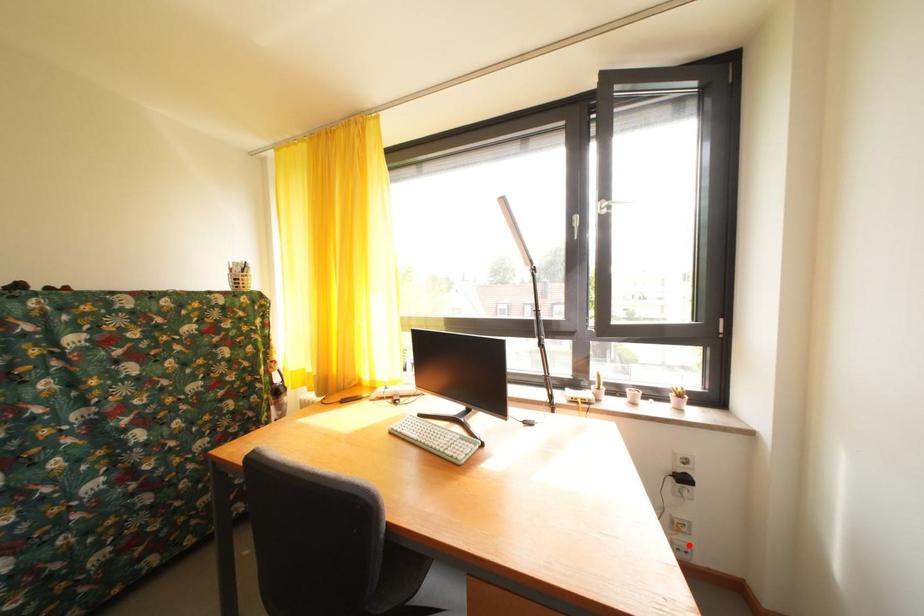
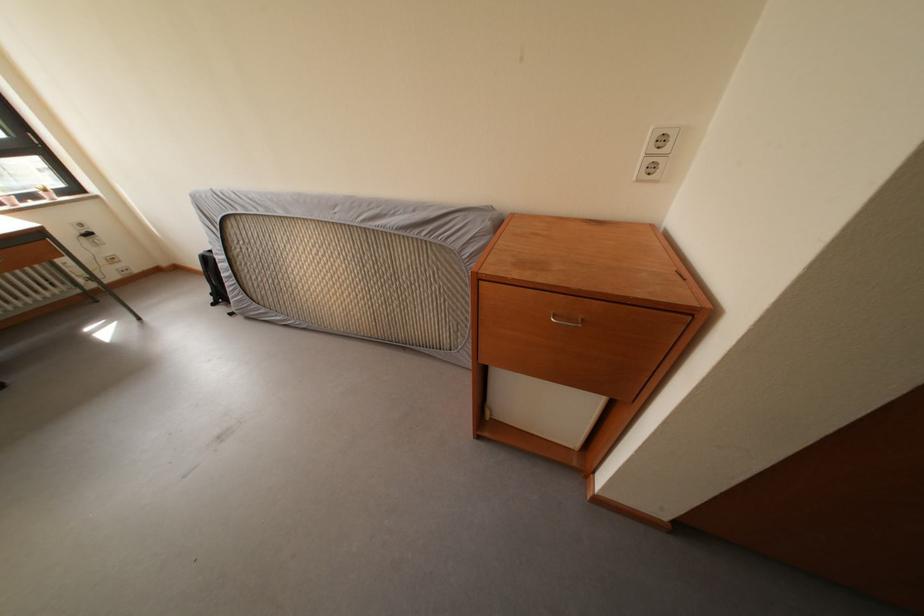
Find the pixel in the second image that matches the highlighted location in the first image.

(128, 273)